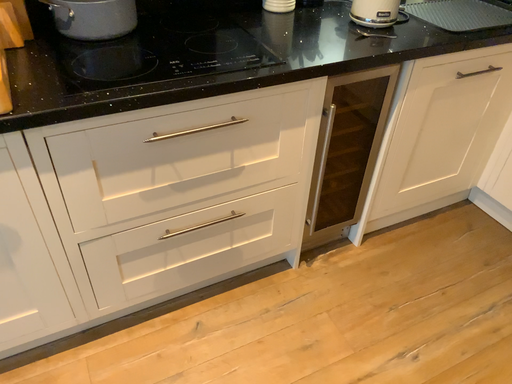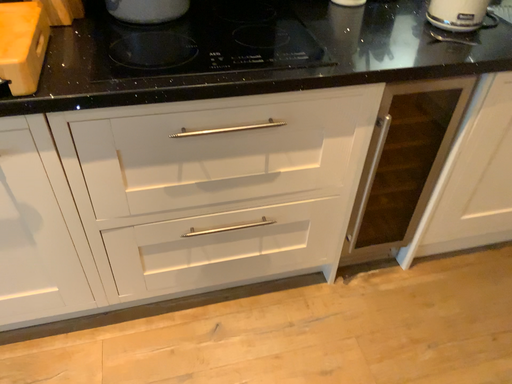
Question: How did the camera likely rotate when shooting the video?

Choices:
 (A) rotated left
 (B) rotated right

Answer: (A)